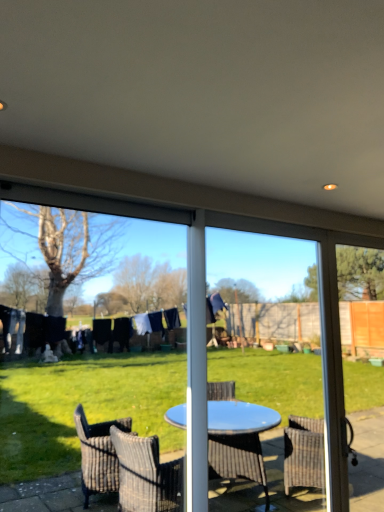
Question: From a real-world perspective, is transparent plastic screen at center physically below blue plastic table at center, the 2th screen door in the right-to-left sequence?

Choices:
 (A) yes
 (B) no

Answer: (B)

Question: Would you say transparent plastic screen at center is a long distance from blue plastic table at center, the 2th screen door in the right-to-left sequence?

Choices:
 (A) yes
 (B) no

Answer: (A)

Question: Could you tell me if transparent plastic screen at center is turned towards blue plastic table at center, the 2th screen door in the right-to-left sequence?

Choices:
 (A) yes
 (B) no

Answer: (B)

Question: Is transparent plastic screen at center bigger than blue plastic table at center, positioned as the 1th screen door in left-to-right order?

Choices:
 (A) no
 (B) yes

Answer: (A)

Question: Considering the relative positions of transparent plastic screen at center and blue plastic table at center, positioned as the 1th screen door in left-to-right order, in the image provided, is transparent plastic screen at center in front of blue plastic table at center, positioned as the 1th screen door in left-to-right order,?

Choices:
 (A) yes
 (B) no

Answer: (A)

Question: Can we say transparent plastic screen at center lies outside blue plastic table at center, the 2th screen door in the right-to-left sequence?

Choices:
 (A) yes
 (B) no

Answer: (A)

Question: From the image's perspective, does blue plastic table at center, the 2th screen door in the right-to-left sequence, appear lower than transparent glass screen door at right, the second screen door when ordered from left to right?

Choices:
 (A) no
 (B) yes

Answer: (A)

Question: Is blue plastic table at center, positioned as the 1th screen door in left-to-right order, positioned beyond the bounds of transparent glass screen door at right, the second screen door when ordered from left to right?

Choices:
 (A) no
 (B) yes

Answer: (B)

Question: Considering the relative sizes of blue plastic table at center, the 2th screen door in the right-to-left sequence, and transparent glass screen door at right, which appears as the 1th screen door when viewed from the right, in the image provided, is blue plastic table at center, the 2th screen door in the right-to-left sequence, bigger than transparent glass screen door at right, which appears as the 1th screen door when viewed from the right,?

Choices:
 (A) no
 (B) yes

Answer: (B)

Question: Is blue plastic table at center, the 2th screen door in the right-to-left sequence, shorter than transparent glass screen door at right, which appears as the 1th screen door when viewed from the right?

Choices:
 (A) no
 (B) yes

Answer: (B)

Question: Is blue plastic table at center, the 2th screen door in the right-to-left sequence, turned away from transparent glass screen door at right, the second screen door when ordered from left to right?

Choices:
 (A) yes
 (B) no

Answer: (B)

Question: From a real-world perspective, is blue plastic table at center, the 2th screen door in the right-to-left sequence, over transparent glass screen door at right, the second screen door when ordered from left to right?

Choices:
 (A) yes
 (B) no

Answer: (A)

Question: Can you confirm if transparent glass screen door at right, which appears as the 1th screen door when viewed from the right, is smaller than blue plastic table at center, positioned as the 1th screen door in left-to-right order?

Choices:
 (A) no
 (B) yes

Answer: (B)